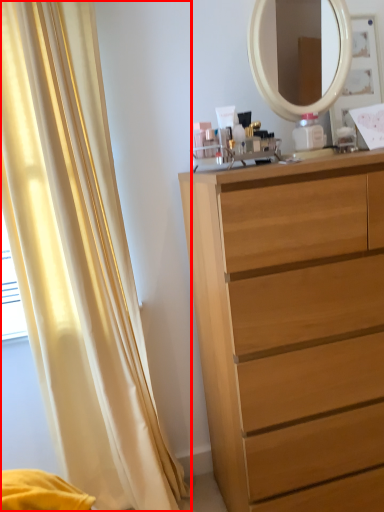
Question: In this image, where is curtain (annotated by the red box) located relative to chest of drawers?

Choices:
 (A) left
 (B) right

Answer: (A)